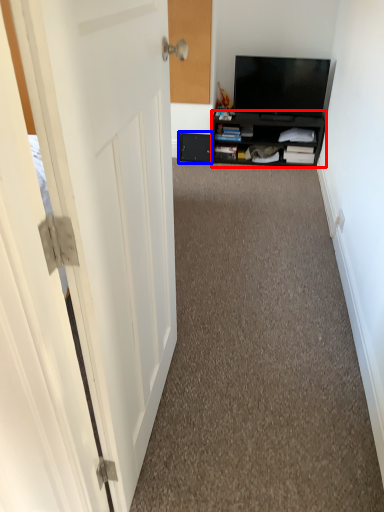
Question: Which object appears closest to the camera in this image, cabinetry (highlighted by a red box) or drawer (highlighted by a blue box)?

Choices:
 (A) cabinetry
 (B) drawer

Answer: (A)